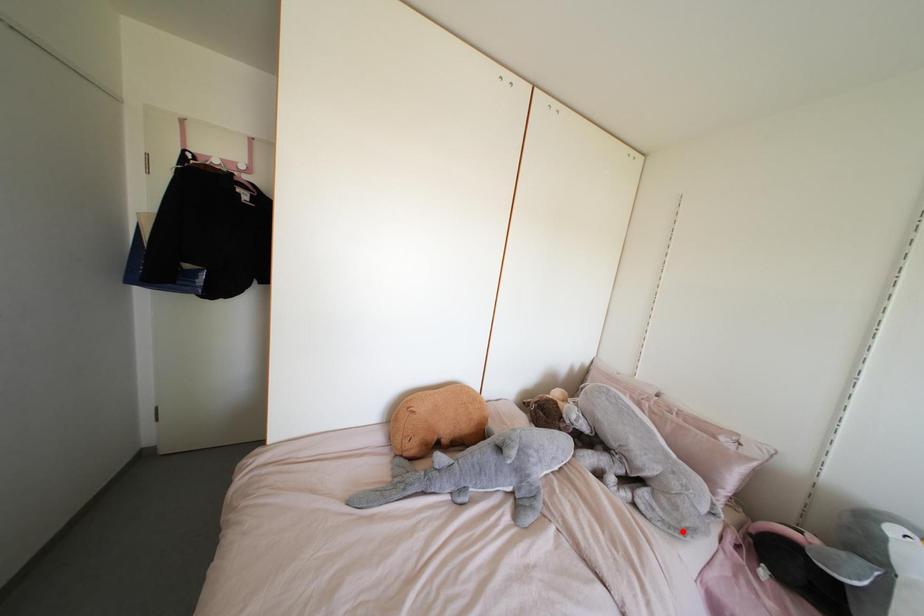
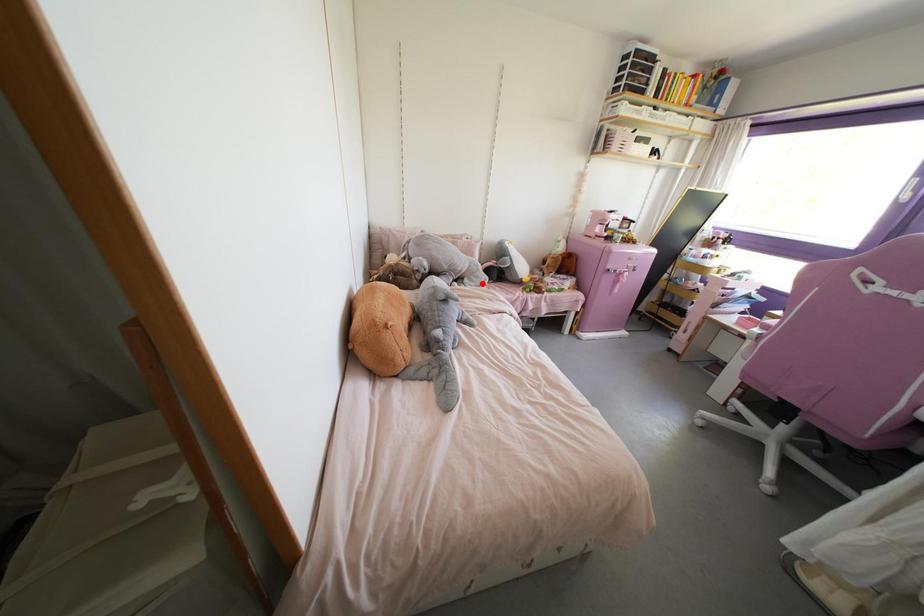
I am providing you with two images of the same scene from different viewpoints. A red point is marked on the first image and another point is marked on the second image. Does the point marked in image1 correspond to the same location as the one in image2?

Yes